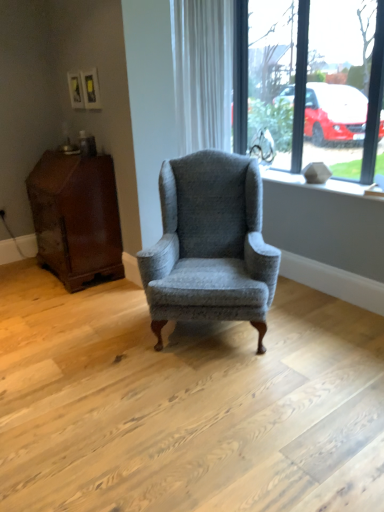
Question: Is white textured curtain at upper center wider or thinner than white textured stone at upper right?

Choices:
 (A) thin
 (B) wide

Answer: (A)

Question: From the image's perspective, is white textured curtain at upper center above or below white textured stone at upper right?

Choices:
 (A) above
 (B) below

Answer: (A)

Question: Which object is positioned farthest from the white textured curtain at upper center?

Choices:
 (A) clear glass window at upper right
 (B) mahogany wood side table at left
 (C) textured gray wingback chair at center
 (D) white textured stone at upper right

Answer: (B)

Question: Considering the real-world distances, which object is farthest from the white textured curtain at upper center?

Choices:
 (A) textured gray wingback chair at center
 (B) white textured stone at upper right
 (C) clear glass window at upper right
 (D) mahogany wood side table at left

Answer: (D)